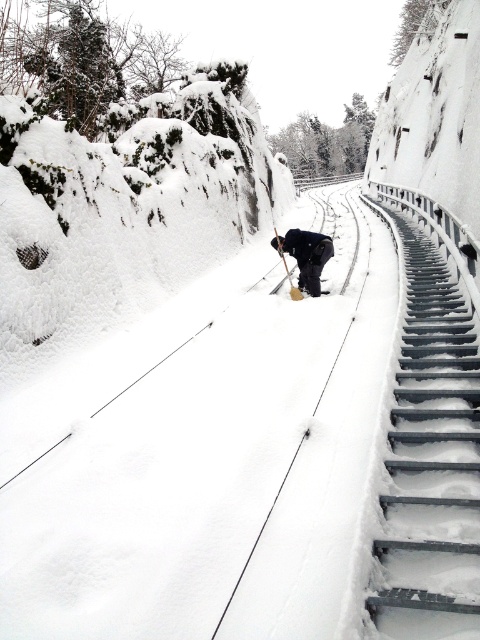
Question: Does dark gray fabric at center appear on the left side of wooden ski pole at center?

Choices:
 (A) no
 (B) yes

Answer: (A)

Question: Which point is farther from the camera taking this photo?

Choices:
 (A) (277, 243)
 (B) (425, 243)
 (C) (332, 250)

Answer: (B)

Question: Which object is farther from the camera taking this photo?

Choices:
 (A) dark gray fabric at center
 (B) wooden ski pole at center

Answer: (B)

Question: Does dark gray fabric at center appear on the left side of wooden ski pole at center?

Choices:
 (A) yes
 (B) no

Answer: (B)

Question: In this image, where is dark gray fabric at center located relative to wooden ski pole at center?

Choices:
 (A) right
 (B) left

Answer: (A)

Question: Which point is closer to the camera?

Choices:
 (A) (451, 500)
 (B) (312, 280)

Answer: (A)